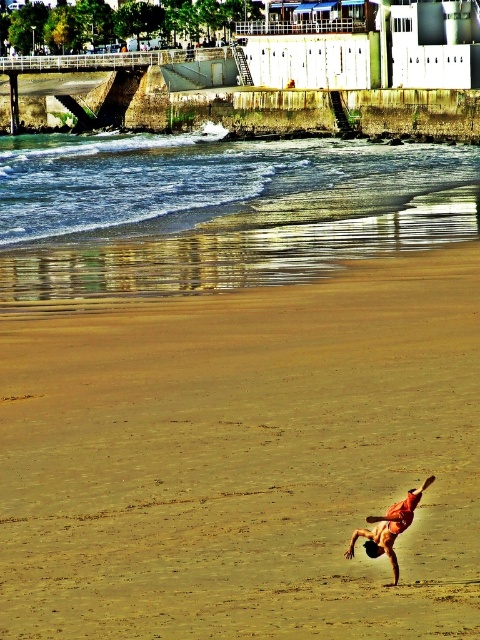
Question: Which point is farther to the camera?

Choices:
 (A) orange fabric gymnast at lower center
 (B) brown sandy beach at center

Answer: (A)

Question: Which object appears closest to the camera in this image?

Choices:
 (A) orange fabric gymnast at lower center
 (B) brown sandy beach at center

Answer: (B)

Question: Does brown sandy beach at center have a smaller size compared to orange fabric gymnast at lower center?

Choices:
 (A) yes
 (B) no

Answer: (B)

Question: Does brown sandy beach at center appear on the right side of orange fabric gymnast at lower center?

Choices:
 (A) yes
 (B) no

Answer: (B)

Question: Which of the following is the farthest from the observer?

Choices:
 (A) orange fabric gymnast at lower center
 (B) brown sandy beach at center

Answer: (A)

Question: Is brown sandy beach at center smaller than orange fabric gymnast at lower center?

Choices:
 (A) no
 (B) yes

Answer: (A)